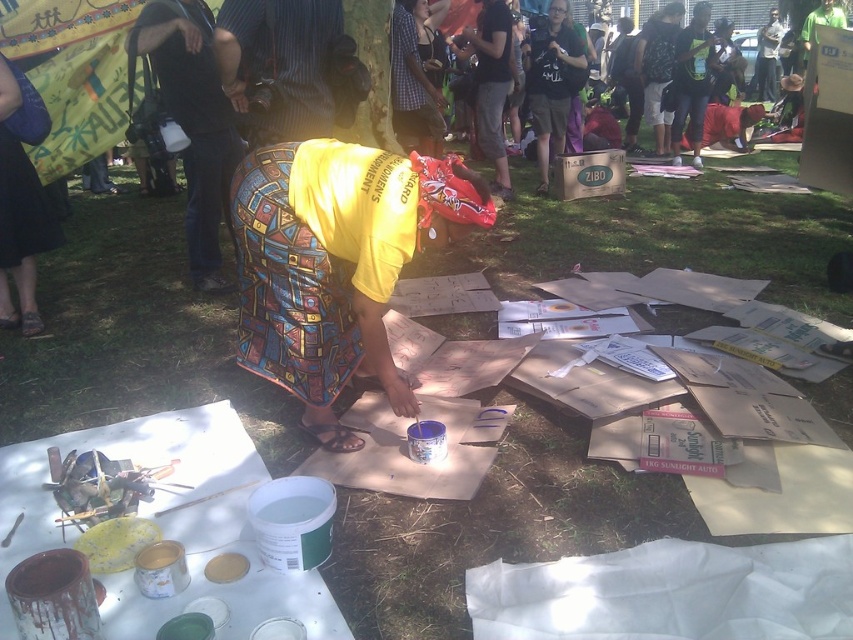
Is yellow printed fabric at center shorter than blue fabric skirt at lower left?

Yes.

Can you confirm if yellow printed fabric at center is bigger than blue fabric skirt at lower left?

Correct, yellow printed fabric at center is larger in size than blue fabric skirt at lower left.

Measure the distance between yellow printed fabric at center and camera.

yellow printed fabric at center is 2.01 meters away from camera.

Where is `yellow printed fabric at center`? yellow printed fabric at center is located at coordinates (323, 269).

Consider the image. Is blue fabric skirt at lower left wider than black cotton shirt at upper center?

No.

Who is higher up, blue fabric skirt at lower left or black cotton shirt at upper center?

black cotton shirt at upper center

What do you see at coordinates (21, 204) in the screenshot?
I see `blue fabric skirt at lower left` at bounding box center [21, 204].

This screenshot has width=853, height=640. I want to click on blue fabric skirt at lower left, so click(21, 204).

Between yellow printed fabric at center and black cotton shirt at upper center, which one appears on the left side from the viewer's perspective?

yellow printed fabric at center

Can you confirm if yellow printed fabric at center is bigger than black cotton shirt at upper center?

No.

Describe the element at coordinates (323, 269) in the screenshot. I see `yellow printed fabric at center` at that location.

The height and width of the screenshot is (640, 853). In order to click on yellow printed fabric at center in this screenshot , I will do `click(323, 269)`.